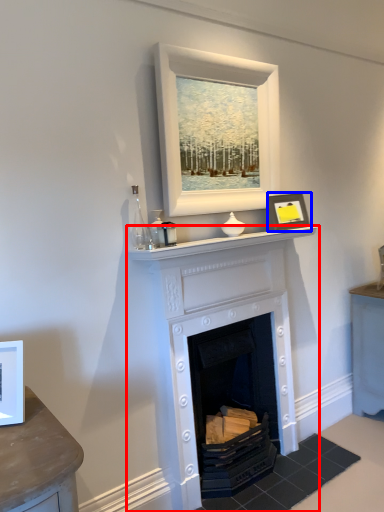
Question: Which object appears closest to the camera in this image, fireplace (highlighted by a red box) or picture frame (highlighted by a blue box)?

Choices:
 (A) fireplace
 (B) picture frame

Answer: (A)